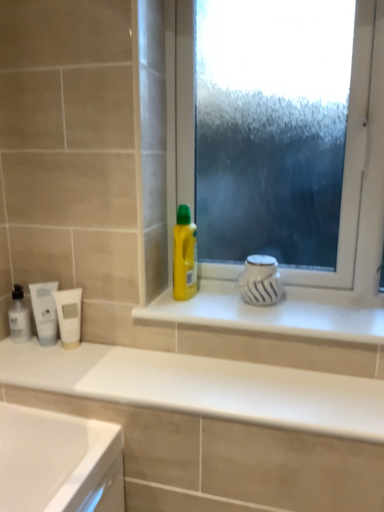
Where is `vacant region in front of white matte tube at left, which is the 2th mouthwash from right to left`? This screenshot has width=384, height=512. vacant region in front of white matte tube at left, which is the 2th mouthwash from right to left is located at coordinates (46, 367).